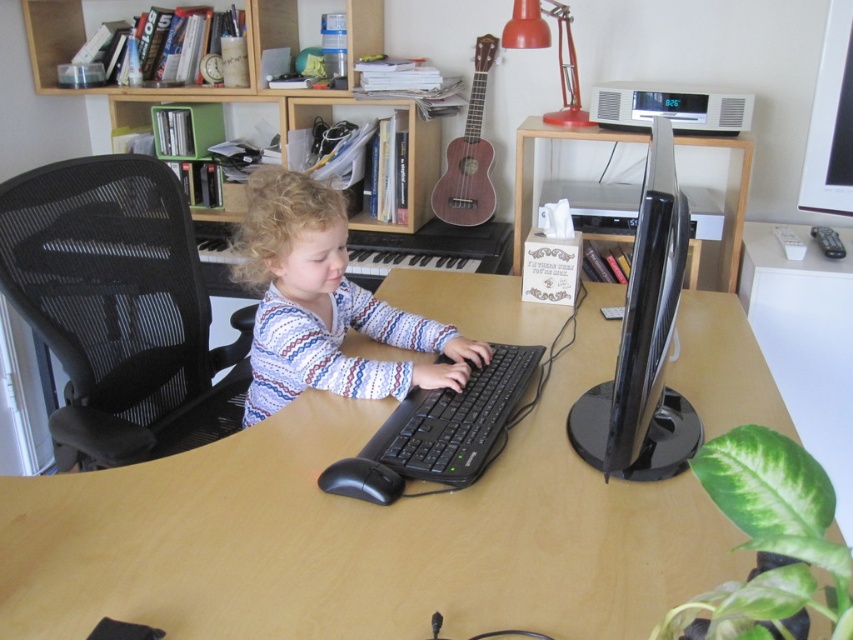
You are helping to rearrange the furniture in the home office. You need to place a large rectangular box that measures 1.2 meters in length. The box must be placed on either the wooden table at center or the black mesh chair at left. Which object can the box fit on?

The wooden table at center is bigger than the black mesh chair at left, so the large rectangular box measuring 1.2 meters in length can fit on the wooden table at center.

You are helping to arrange furniture in the home office. You have a wooden table at center and a black glossy monitor at center right. Which object takes up more space in the office?

The wooden table at center is larger in size than the black glossy monitor at center right, so it takes up more space in the office.

You are a delivery robot in a home office. You need to deliver a package to the location marked by the point at coordinates [325,305]. The white textured sweater at center is currently occupied by a child sitting at the desk. Can you place the package directly at the marked point without moving the child?

The point at coordinates [325,305] is on the white textured sweater at center, which is occupied by the child. Therefore, you cannot place the package directly at that point without moving the child.